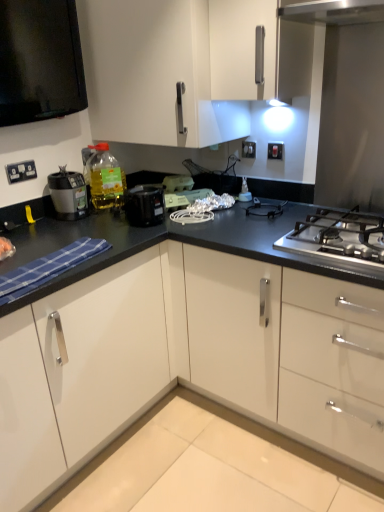
Question: Should I look upward or downward to see clear plastic spray bottle at center, placed as the first appliance when sorted from right to left?

Choices:
 (A) up
 (B) down

Answer: (A)

Question: Is matte black blender at left, the 1th kitchen appliance when ordered from left to right, to the right of black plastic coffee maker at upper left, which is the first kitchen appliance from right to left, from the viewer's perspective?

Choices:
 (A) yes
 (B) no

Answer: (B)

Question: Can you confirm if matte black blender at left, the 1th kitchen appliance when ordered from left to right, is taller than black plastic coffee maker at upper left, which is counted as the 2th kitchen appliance, starting from the left?

Choices:
 (A) no
 (B) yes

Answer: (B)

Question: Is matte black blender at left, placed as the second kitchen appliance when sorted from right to left, not inside black plastic coffee maker at upper left, which is the first kitchen appliance from right to left?

Choices:
 (A) no
 (B) yes

Answer: (B)

Question: Considering the relative sizes of matte black blender at left, placed as the second kitchen appliance when sorted from right to left, and black plastic coffee maker at upper left, which is the first kitchen appliance from right to left, in the image provided, is matte black blender at left, placed as the second kitchen appliance when sorted from right to left, wider than black plastic coffee maker at upper left, which is the first kitchen appliance from right to left,?

Choices:
 (A) yes
 (B) no

Answer: (B)

Question: Does matte black blender at left, placed as the second kitchen appliance when sorted from right to left, lie in front of black plastic coffee maker at upper left, which is counted as the 2th kitchen appliance, starting from the left?

Choices:
 (A) yes
 (B) no

Answer: (B)

Question: Does matte black blender at left, the 1th kitchen appliance when ordered from left to right, appear on the left side of black plastic coffee maker at upper left, which is counted as the 2th kitchen appliance, starting from the left?

Choices:
 (A) no
 (B) yes

Answer: (B)

Question: Would you consider white plastic toaster at center, placed as the 3th appliance when sorted from right to left, to be distant from clear plastic spray bottle at center, placed as the first appliance when sorted from right to left?

Choices:
 (A) yes
 (B) no

Answer: (B)

Question: From the image's perspective, is white plastic toaster at center, acting as the first appliance starting from the left, below clear plastic spray bottle at center, the 3th appliance when ordered from left to right?

Choices:
 (A) yes
 (B) no

Answer: (B)

Question: Considering the relative sizes of white plastic toaster at center, placed as the 3th appliance when sorted from right to left, and clear plastic spray bottle at center, placed as the first appliance when sorted from right to left, in the image provided, is white plastic toaster at center, placed as the 3th appliance when sorted from right to left, wider than clear plastic spray bottle at center, placed as the first appliance when sorted from right to left,?

Choices:
 (A) yes
 (B) no

Answer: (A)

Question: Is clear plastic spray bottle at center, placed as the first appliance when sorted from right to left, a part of white plastic toaster at center, acting as the first appliance starting from the left?

Choices:
 (A) yes
 (B) no

Answer: (B)

Question: From the image's perspective, is white plastic toaster at center, acting as the first appliance starting from the left, on clear plastic spray bottle at center, placed as the first appliance when sorted from right to left?

Choices:
 (A) no
 (B) yes

Answer: (B)

Question: Can you confirm if white plastic toaster at center, placed as the 3th appliance when sorted from right to left, is bigger than clear plastic spray bottle at center, the 3th appliance when ordered from left to right?

Choices:
 (A) yes
 (B) no

Answer: (A)

Question: Does white glossy cabinet at upper center appear on the left side of white plastic electrical outlet at upper left, the 3th electric outlet in the back-to-front sequence?

Choices:
 (A) no
 (B) yes

Answer: (A)